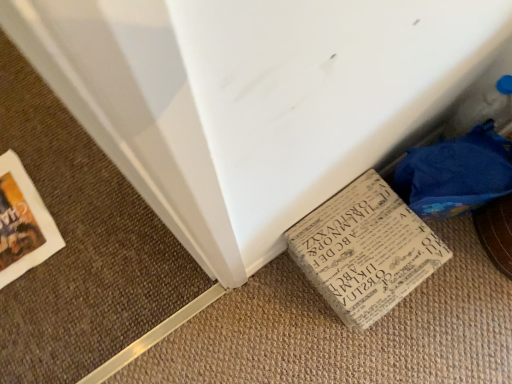
This screenshot has height=384, width=512. What are the coordinates of `unoccupied region to the right of printed paper book at lower right` in the screenshot? It's located at (465, 291).